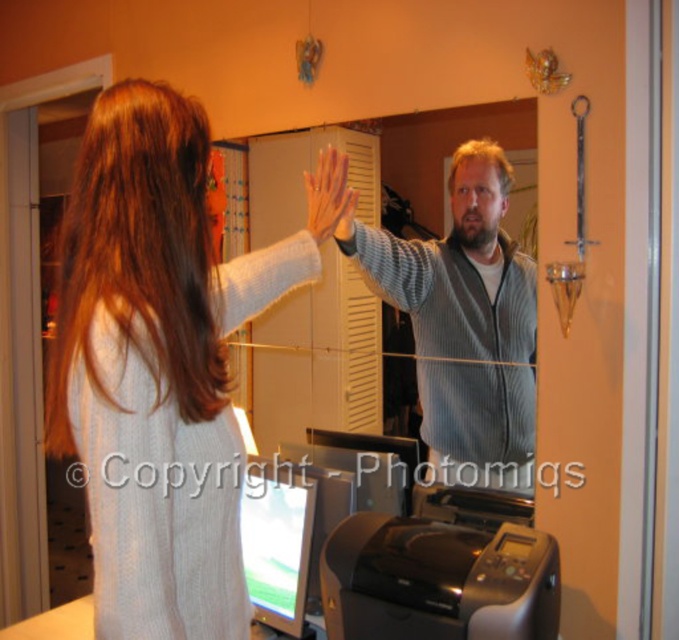
Based on the photo, you are a delivery person who needs to place a small package between the white knitted sweater at upper left and the black plastic printer at lower center. Can you fit the package there if it measures 50 centimeters in length?

The white knitted sweater at upper left and black plastic printer at lower center are 52.06 centimeters apart from each other. Since the package is 50 centimeters long, it should fit between them with about 2 centimeters of space remaining.

You are a delivery person who needs to place a small package between the gray ribbed sweater at center and the black plastic printer at lower center. Is there enough space to fit the package, which is 19 inches long?

The gray ribbed sweater at center and black plastic printer at lower center are 18.97 inches apart from each other. Since the package is 19 inches long, it would not fit between them because the space is slightly smaller than the package.

You are organizing a charity event and need to decide which item to donate first between the white knitted sweater at upper left and the black plastic printer at lower center. Based on their sizes, which item takes up more space?

The white knitted sweater at upper left is larger in size than the black plastic printer at lower center, so it takes up more space.